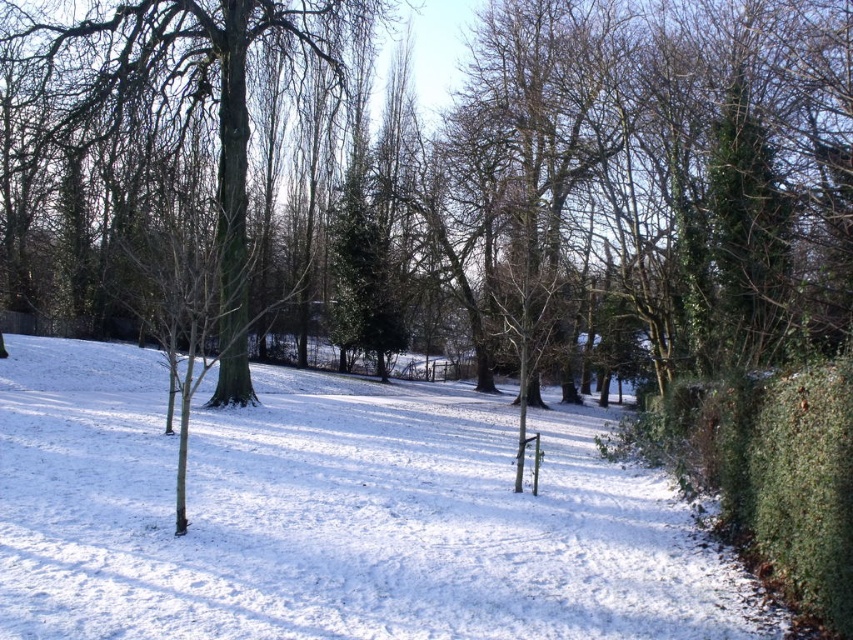
You are planning to place a small garden ornament between the green leafy hedge at right and the green matte tree at center. Which side of the ornament should face the smaller object?

The green leafy hedge at right is smaller than the green matte tree at center, so the ornament should face the green leafy hedge at right.

Looking at this image, you are planning to install a bird feeder in the park. The bird feeder requires a support structure that can be placed under a tree or near a hedge. Based on the scene, which object, the green leafy hedge at right or the green matte tree at center, would provide a more stable base for the bird feeder due to its height?

The green matte tree at center is taller than the green leafy hedge at right, so it would provide a more stable base for the bird feeder due to its height.

You are standing at the center of the winter scene and want to walk towards the green leafy hedge at right. Which direction should you face to head directly towards it?

The green leafy hedge at right is located at point 0.741 on the x and 0.899 on the y coordinate. Since you are at the center, you should face towards the northeast direction to head directly towards it.